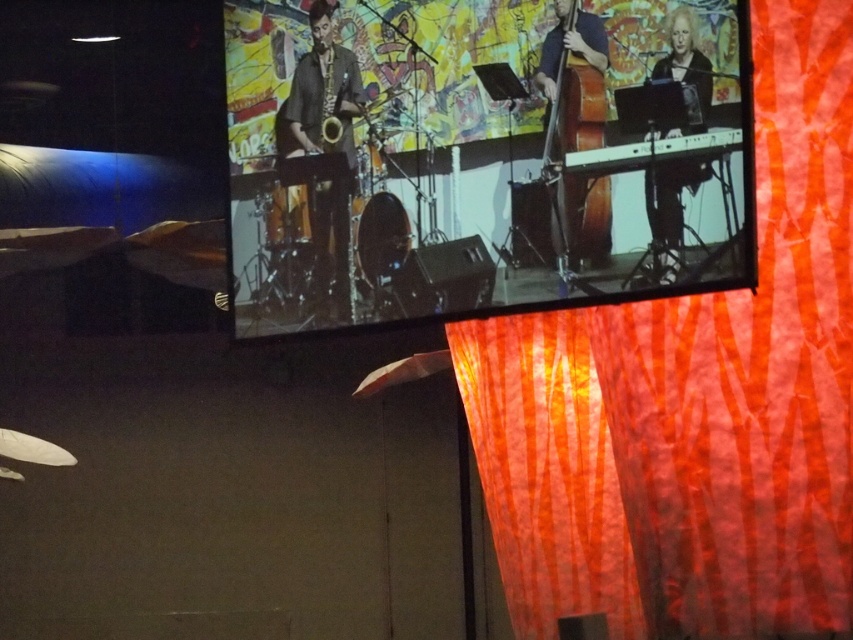
You are a photographer at the event and want to capture a photo that includes both the matte black screen at upper center and the orange striped fabric at right. Based on their positions, which object should appear higher in the photo?

The matte black screen at upper center should appear higher in the photo because it is positioned above the orange striped fabric at right.